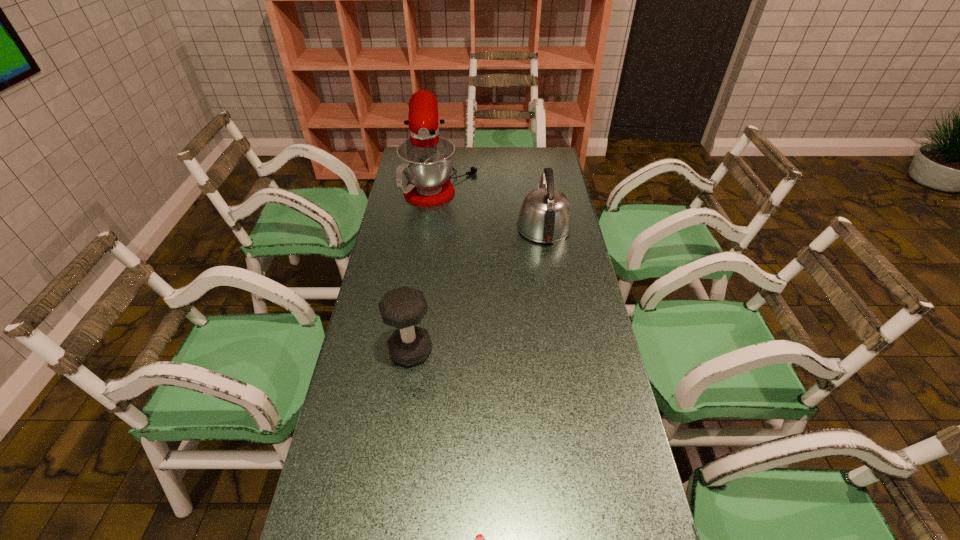
Locate an element on the screen. The width and height of the screenshot is (960, 540). dumbbell located in the left edge section of the desktop is located at coordinates (404, 307).

Identify the location of object that is at the right edge. The width and height of the screenshot is (960, 540). (545, 216).

Find the location of a particular element. The width and height of the screenshot is (960, 540). object at the far left corner is located at coordinates (426, 159).

In order to click on free region at the far edge in this screenshot , I will do `click(521, 162)`.

At what (x,y) coordinates should I click in order to perform the action: click on free space at the left edge of the desktop. Please return your answer as a coordinate pair (x, y). The width and height of the screenshot is (960, 540). Looking at the image, I should click on (350, 441).

Where is `vacant point at the right edge`? The width and height of the screenshot is (960, 540). vacant point at the right edge is located at coordinates (599, 462).

Image resolution: width=960 pixels, height=540 pixels. What are the coordinates of `vacant space at the far right corner of the desktop` in the screenshot? It's located at (528, 148).

What are the coordinates of `free space between the dumbbell and the mixer` in the screenshot? It's located at (426, 264).

Image resolution: width=960 pixels, height=540 pixels. I want to click on vacant region between the rightmost object and the mixer, so click(492, 202).

At what (x,y) coordinates should I click in order to perform the action: click on free space between the third farthest object and the rightmost object. Please return your answer as a coordinate pair (x, y). The width and height of the screenshot is (960, 540). Looking at the image, I should click on (477, 289).